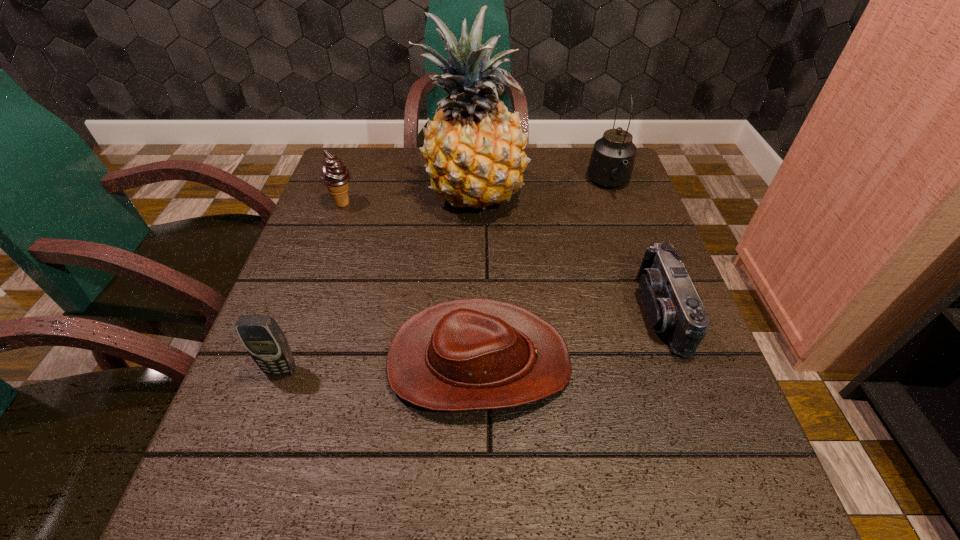
I want to click on the tallest object, so click(x=474, y=148).

The height and width of the screenshot is (540, 960). What are the coordinates of `kettle` in the screenshot? It's located at (611, 164).

Where is `icecream`? icecream is located at coordinates (335, 176).

This screenshot has height=540, width=960. Find the location of `cellular telephone`. cellular telephone is located at coordinates (262, 337).

What are the coordinates of `camcorder` in the screenshot? It's located at (671, 300).

At what (x,y) coordinates should I click in order to perform the action: click on the shortest object. Please return your answer as a coordinate pair (x, y). The image size is (960, 540). Looking at the image, I should click on (469, 354).

What are the coordinates of `vacant space positioned 0.320m on the front of the pineapple` in the screenshot? It's located at (470, 340).

I want to click on free space located spout on the fifth shortest object, so click(x=657, y=316).

Where is `vacant space located on the right of the icecream`? The image size is (960, 540). vacant space located on the right of the icecream is located at coordinates (380, 203).

Locate an element on the screen. free location located on the front face of the cellular telephone is located at coordinates (261, 426).